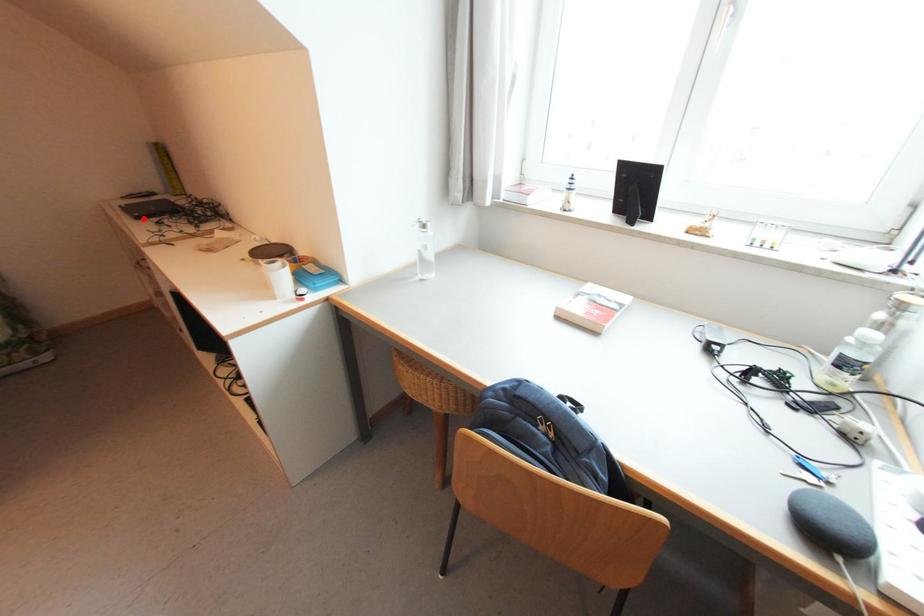
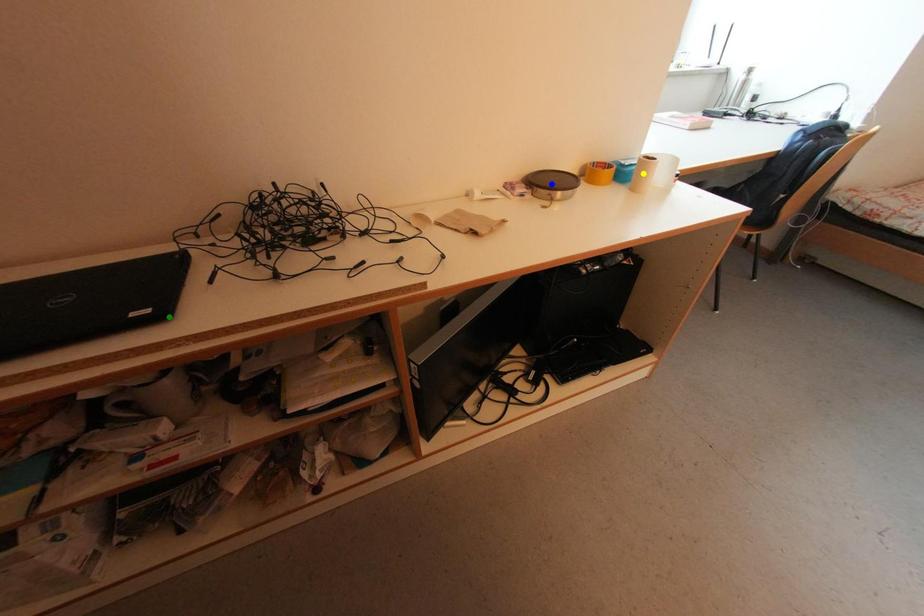
Question: I am providing you with two images of the same scene from different viewpoints. A red point is marked on the first image. You are given multiple points on the second image. Which mark in image 2 goes with the point in image 1?

Choices:
 (A) green point
 (B) blue point
 (C) yellow point

Answer: (A)